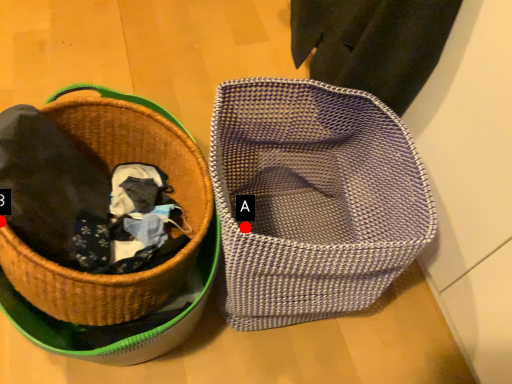
Question: Two points are circled on the image, labeled by A and B beside each circle. Which point appears closest to the camera in this image?

Choices:
 (A) A is closer
 (B) B is closer

Answer: (B)